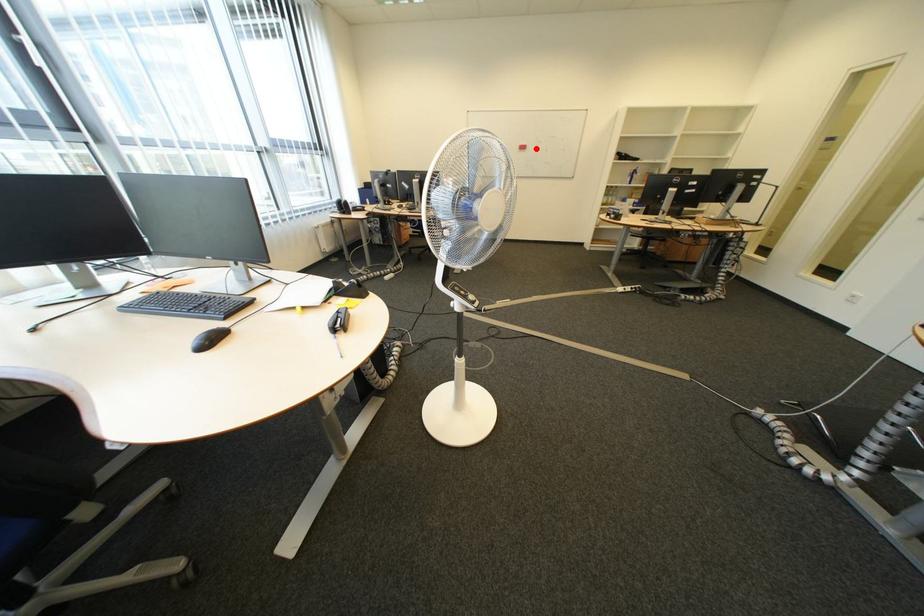
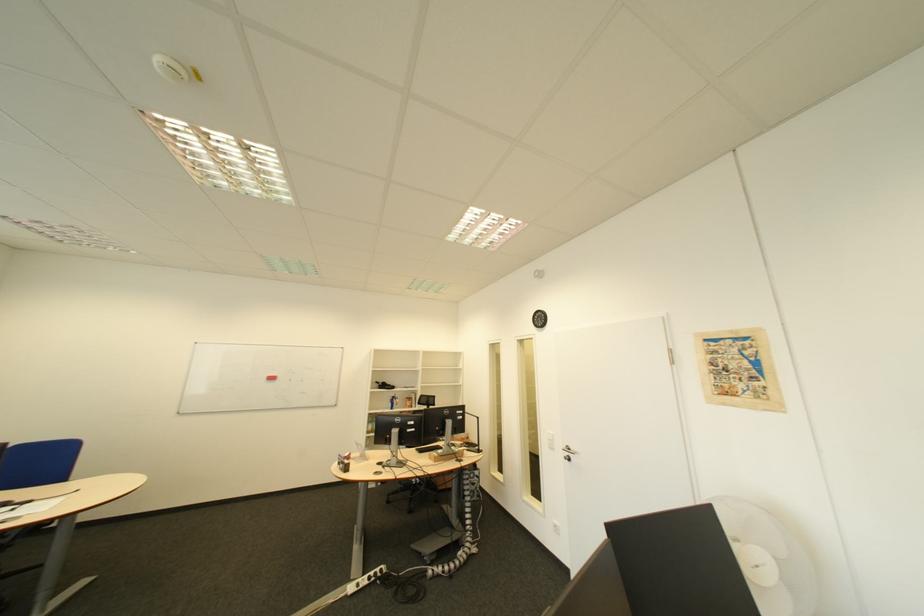
Question: A red point is marked in image1. In image2, is the corresponding 3D point closer to the camera or farther? Reply with the corresponding letter.

Choices:
 (A) The corresponding 3D point is closer.
 (B) The corresponding 3D point is farther.

Answer: (B)